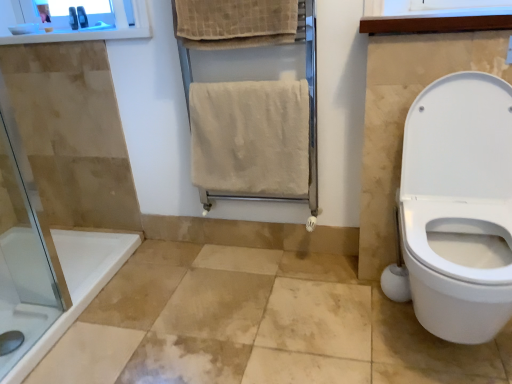
Question: From the image's perspective, is metallic gray razor at upper left, which appears as the second toiletry when viewed from the right, above or below white wood window frame at upper right?

Choices:
 (A) below
 (B) above

Answer: (B)

Question: Considering the positions of metallic gray razor at upper left, which appears as the second toiletry when viewed from the right, and white wood window frame at upper right in the image, is metallic gray razor at upper left, which appears as the second toiletry when viewed from the right, bigger or smaller than white wood window frame at upper right?

Choices:
 (A) small
 (B) big

Answer: (A)

Question: Considering the real-world distances, which object is farthest from the beige textured towel at upper center, the 2th bath towel ordered from the bottom?

Choices:
 (A) matte plastic toothbrush at upper left, the 1th toiletry positioned from the right
 (B) metallic gray razor at upper left, which appears as the second toiletry when viewed from the right
 (C) wooden medicine cabinet at upper center
 (D) white wood window frame at upper right
 (E) beige soft towel at center, which is the first bath towel from bottom to top

Answer: (B)

Question: Estimate the real-world distances between objects in this image. Which object is farther from the beige towel rack at center?

Choices:
 (A) metallic gray razor at upper left, which appears as the second toiletry when viewed from the right
 (B) matte plastic toothbrush at upper left, marked as the second toiletry in a left-to-right arrangement
 (C) beige textured towel at upper center, the 1th bath towel viewed from the top
 (D) wooden medicine cabinet at upper center
 (E) white wood window frame at upper right

Answer: (A)